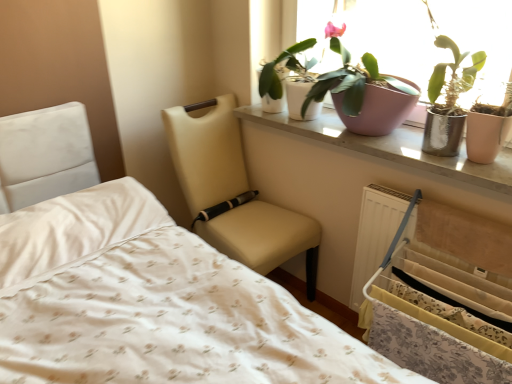
Question: Looking at their shapes, would you say white fabric bed frame at lower right is wider or thinner than white glossy pot at upper center, the second houseplant viewed from the right?

Choices:
 (A) wide
 (B) thin

Answer: (A)

Question: From a real-world perspective, relative to white glossy pot at upper center, the second houseplant viewed from the right, is white fabric bed frame at lower right vertically above or below?

Choices:
 (A) above
 (B) below

Answer: (B)

Question: Considering the real-world distances, which object is closest to the beige leather chair at center?

Choices:
 (A) pink ceramic window sill at upper center
 (B) pink matte pot at upper center, the first houseplant from the right
 (C) white fabric bed frame at lower right
 (D) white glossy pot at upper center, marked as the first houseplant in a left-to-right arrangement
 (E) pink ceramic pots at upper right

Answer: (A)

Question: Which of these objects is positioned closest to the white fabric bed frame at lower right?

Choices:
 (A) pink matte pot at upper center, marked as the 2th houseplant in a left-to-right arrangement
 (B) white glossy pot at upper center, marked as the first houseplant in a left-to-right arrangement
 (C) pink ceramic window sill at upper center
 (D) beige leather chair at center
 (E) pink ceramic pots at upper right

Answer: (C)